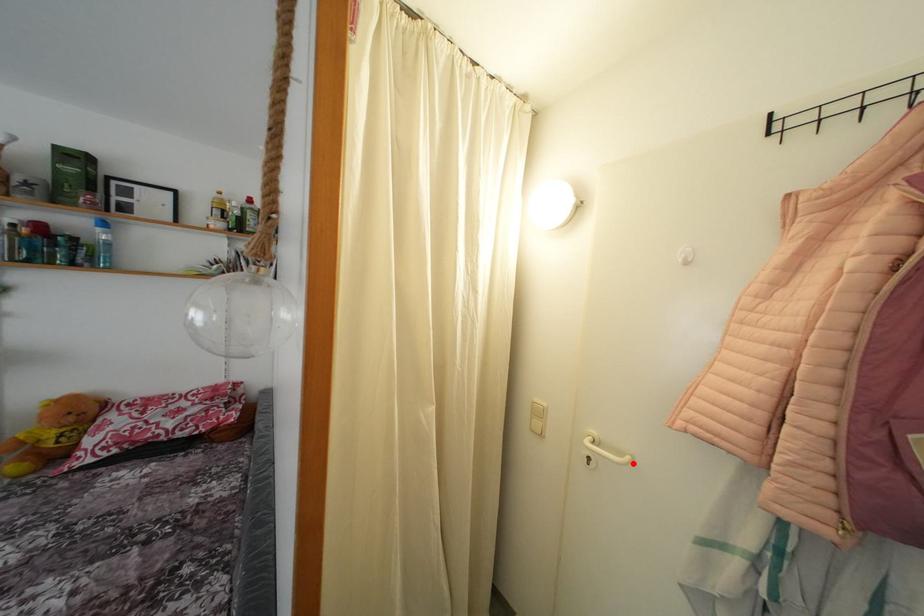
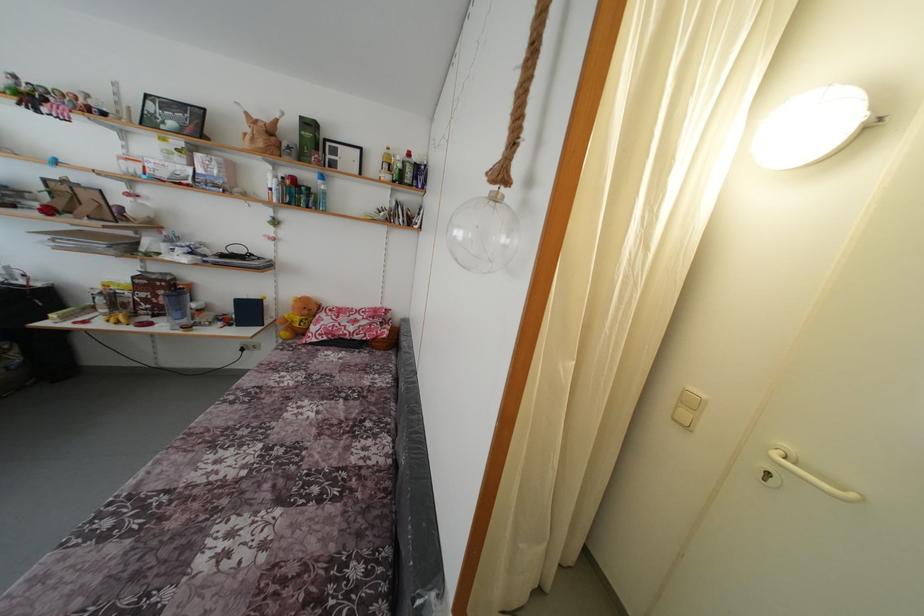
Where in the second image is the point corresponding to the highlighted location from the first image?

(859, 501)